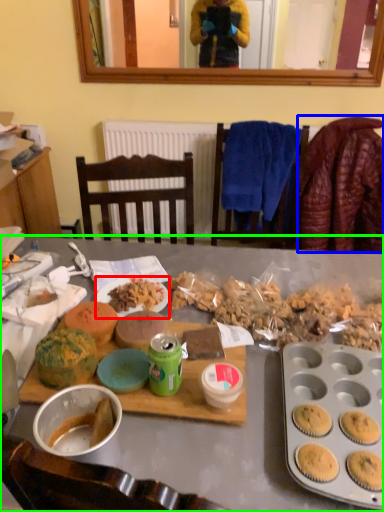
Question: Considering the real-world distances, which object is closest to plate (highlighted by a red box)? blanket (highlighted by a blue box) or desk (highlighted by a green box).

Choices:
 (A) blanket
 (B) desk

Answer: (B)